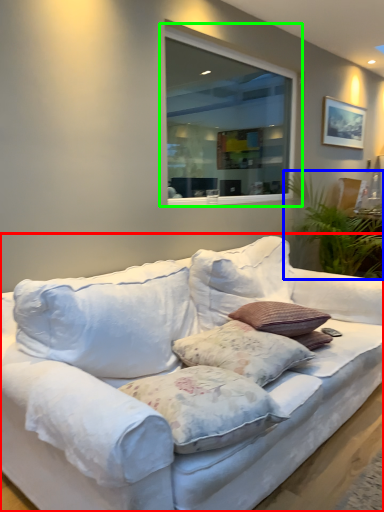
Question: Considering the real-world distances, which object is farthest from studio couch (highlighted by a red box)? plant (highlighted by a blue box) or window (highlighted by a green box)?

Choices:
 (A) plant
 (B) window

Answer: (B)